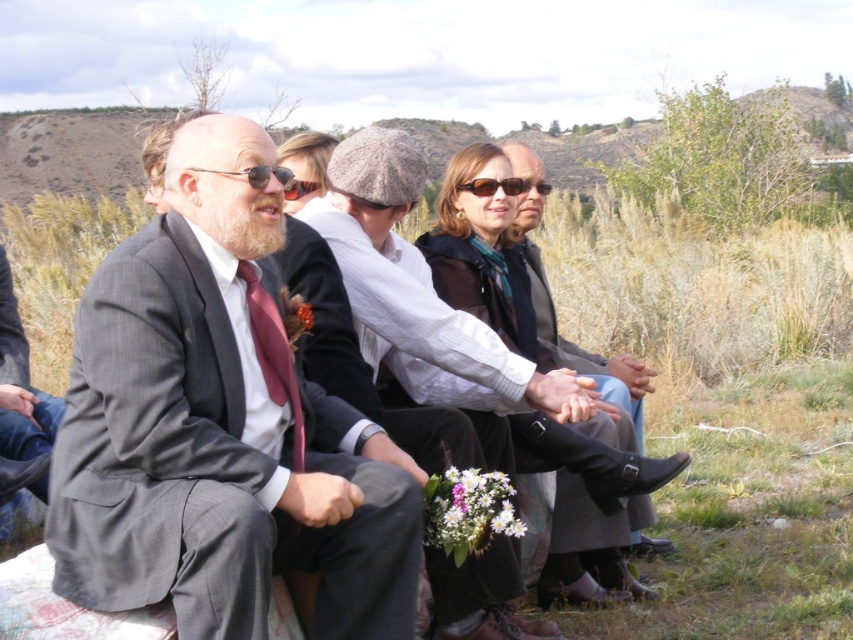
Who is positioned more to the right, leather boots at center or matte brown sunglasses at center?

leather boots at center is more to the right.

This screenshot has width=853, height=640. What do you see at coordinates (553, 305) in the screenshot?
I see `leather boots at center` at bounding box center [553, 305].

Which is in front, point (526, 166) or point (471, 182)?

Point (471, 182) is in front.

Where is `leather boots at center`? leather boots at center is located at coordinates (553, 305).

What do you see at coordinates (219, 426) in the screenshot? Image resolution: width=853 pixels, height=640 pixels. I see `matte gray suit at left` at bounding box center [219, 426].

Is matte gray suit at left to the right of leather boots at center from the viewer's perspective?

Incorrect, matte gray suit at left is not on the right side of leather boots at center.

Which is behind, point (300, 564) or point (544, 307)?

Point (544, 307)

Find the location of a particular element. The image size is (853, 640). matte gray suit at left is located at coordinates (219, 426).

Is leather boots at center above sunglasses at center?

No, leather boots at center is not above sunglasses at center.

Is point (514, 172) farther from camera compared to point (292, 177)?

That is True.

This screenshot has height=640, width=853. What are the coordinates of `leather boots at center` in the screenshot? It's located at 553,305.